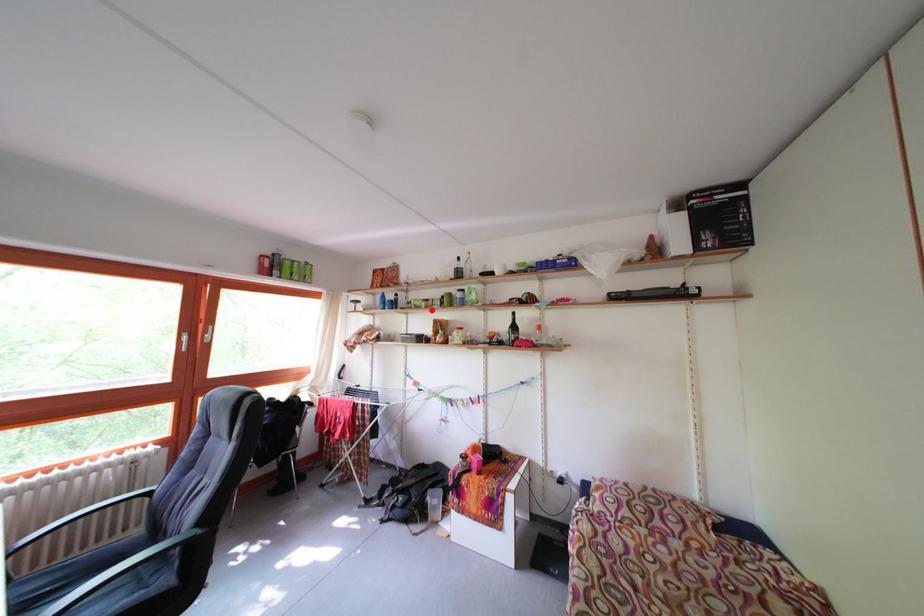
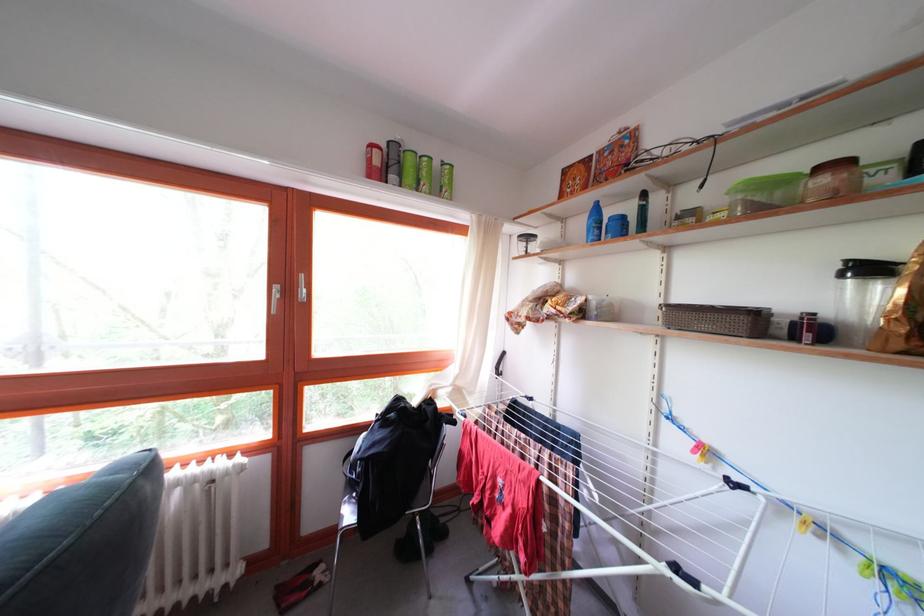
The point at the highlighted location is marked in the first image. Where is the corresponding point in the second image?

(832, 187)